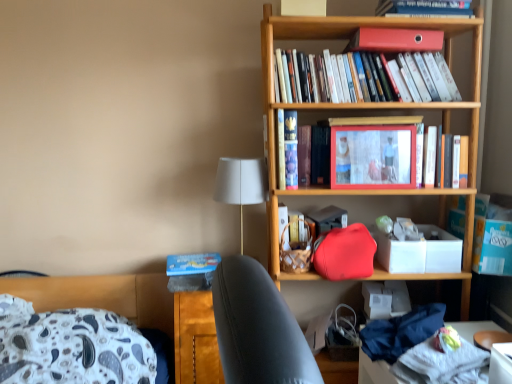
In order to face matte red book at upper center, which is the first paperback book in front-to-back order, should I rotate leftwards or rightwards?

To align with it, rotate right about 17.708°.

Where is `blue matte paperback book at lower left, which is the first paperback book in left-to-right order`? Image resolution: width=512 pixels, height=384 pixels. blue matte paperback book at lower left, which is the first paperback book in left-to-right order is located at coordinates (192, 263).

The height and width of the screenshot is (384, 512). What do you see at coordinates (241, 184) in the screenshot?
I see `white fabric lampshade at center` at bounding box center [241, 184].

Measure the distance between white fabric lampshade at center and camera.

white fabric lampshade at center and camera are 5.31 feet apart.

Describe the element at coordinates (420, 252) in the screenshot. I see `white matte box at center-right` at that location.

Find the location of a particular element. hardcover book at center, placed as the 3th book when sorted from top to bottom is located at coordinates (451, 160).

Where is `hardcover books at upper center, marked as the third book in a bottom-to-top arrangement`? The width and height of the screenshot is (512, 384). hardcover books at upper center, marked as the third book in a bottom-to-top arrangement is located at coordinates (362, 78).

Identify the location of matte red book at upper center, positioned as the first paperback book in right-to-left order. Image resolution: width=512 pixels, height=384 pixels. (395, 40).

From a real-world perspective, is blue matte paperback book at lower left, the first paperback book in the back-to-front sequence, below hardcover books at upper center, marked as the third book in a bottom-to-top arrangement?

Yes, from a real-world perspective, blue matte paperback book at lower left, the first paperback book in the back-to-front sequence, is beneath hardcover books at upper center, marked as the third book in a bottom-to-top arrangement.

Considering the positions of objects blue matte paperback book at lower left, the first paperback book from the bottom, and hardcover books at upper center, marked as the third book in a bottom-to-top arrangement, in the image provided, who is in front, blue matte paperback book at lower left, the first paperback book from the bottom, or hardcover books at upper center, marked as the third book in a bottom-to-top arrangement,?

hardcover books at upper center, marked as the third book in a bottom-to-top arrangement.

Looking at this image, is blue matte paperback book at lower left, which is the first paperback book in left-to-right order, directly adjacent to hardcover books at upper center, which is counted as the 1th book, starting from the top?

blue matte paperback book at lower left, which is the first paperback book in left-to-right order, and hardcover books at upper center, which is counted as the 1th book, starting from the top, are not in contact.

Considering the points (195, 269) and (436, 64), which point is in front, point (195, 269) or point (436, 64)?

Positioned in front is point (436, 64).

Relative to hardcover book at center, placed as the 3th book when sorted from top to bottom, is matte plastic picture frame at center in front or behind?

matte plastic picture frame at center is positioned closer to the viewer than hardcover book at center, placed as the 3th book when sorted from top to bottom.

From the image's perspective, between matte plastic picture frame at center and hardcover book at center, the first book in the bottom-to-top sequence, which one is located above?

From the image's view, matte plastic picture frame at center is above.

In terms of width, does matte plastic picture frame at center look wider or thinner when compared to hardcover book at center, the first book in the bottom-to-top sequence?

Clearly, matte plastic picture frame at center has less width compared to hardcover book at center, the first book in the bottom-to-top sequence.

Considering the relative positions of matte plastic picture frame at center and hardcover book at center, which is counted as the 2th book, starting from the bottom, in the image provided, is matte plastic picture frame at center behind hardcover book at center, which is counted as the 2th book, starting from the bottom,?

No, the depth of matte plastic picture frame at center is less than that of hardcover book at center, which is counted as the 2th book, starting from the bottom.

Consider the image. Is the surface of matte plastic picture frame at center in direct contact with hardcover book at center, which ranks as the second book in top-to-bottom order?

matte plastic picture frame at center and hardcover book at center, which ranks as the second book in top-to-bottom order, are clearly separated.

Who is bigger, matte plastic picture frame at center or hardcover book at center, which is counted as the 2th book, starting from the bottom?

hardcover book at center, which is counted as the 2th book, starting from the bottom, is bigger.

In terms of width, does matte plastic picture frame at center look wider or thinner when compared to hardcover book at center, which is counted as the 2th book, starting from the bottom?

Considering their sizes, matte plastic picture frame at center looks slimmer than hardcover book at center, which is counted as the 2th book, starting from the bottom.

Can you confirm if hardcover book at center, which ranks as the second book in top-to-bottom order, is taller than blue matte paperback book at lower left, the first paperback book in the back-to-front sequence?

Yes, hardcover book at center, which ranks as the second book in top-to-bottom order, is taller than blue matte paperback book at lower left, the first paperback book in the back-to-front sequence.

In the scene shown: Can you tell me how much hardcover book at center, which is counted as the 2th book, starting from the bottom, and blue matte paperback book at lower left, the 2th paperback book positioned from the top, differ in facing direction?

The facing directions of hardcover book at center, which is counted as the 2th book, starting from the bottom, and blue matte paperback book at lower left, the 2th paperback book positioned from the top, are 5.22 degrees apart.

Looking at this image, which object is thinner, hardcover book at center, which is counted as the 2th book, starting from the bottom, or blue matte paperback book at lower left, which ranks as the 2th paperback book in front-to-back order?

hardcover book at center, which is counted as the 2th book, starting from the bottom.

From a real-world perspective, which is physically below, hardcover book at center, which is counted as the 2th book, starting from the bottom, or blue matte paperback book at lower left, the 2th paperback book positioned from the top?

From a 3D spatial view, blue matte paperback book at lower left, the 2th paperback book positioned from the top, is below.

Is hardcover book at center, placed as the 3th book when sorted from top to bottom, inside matte red book at upper center, acting as the second paperback book starting from the left?

No, hardcover book at center, placed as the 3th book when sorted from top to bottom, is not surrounded by matte red book at upper center, acting as the second paperback book starting from the left.

From the image's perspective, which is above, matte red book at upper center, positioned as the first paperback book in right-to-left order, or hardcover book at center, the first book in the bottom-to-top sequence?

From the image's view, matte red book at upper center, positioned as the first paperback book in right-to-left order, is above.

Who is shorter, matte red book at upper center, positioned as the first paperback book in right-to-left order, or hardcover book at center, placed as the 3th book when sorted from top to bottom?

matte red book at upper center, positioned as the first paperback book in right-to-left order, is shorter.

Does matte red book at upper center, which is the first paperback book in front-to-back order, have a lesser width compared to hardcover book at center, placed as the 3th book when sorted from top to bottom?

In fact, matte red book at upper center, which is the first paperback book in front-to-back order, might be wider than hardcover book at center, placed as the 3th book when sorted from top to bottom.

Is blue matte paperback book at lower left, acting as the second paperback book starting from the right, not close to white matte box at center-right?

blue matte paperback book at lower left, acting as the second paperback book starting from the right, is actually quite close to white matte box at center-right.

In terms of height, does blue matte paperback book at lower left, the 2th paperback book positioned from the top, look taller or shorter compared to white matte box at center-right?

→ Considering their sizes, blue matte paperback book at lower left, the 2th paperback book positioned from the top, has less height than white matte box at center-right.

Is blue matte paperback book at lower left, which is the first paperback book in left-to-right order, oriented towards white matte box at center-right?

No, blue matte paperback book at lower left, which is the first paperback book in left-to-right order, is not facing towards white matte box at center-right.

From the image's perspective, would you say matte red book at upper center, the 2th paperback book when ordered from back to front, is positioned over hardcover book at center, which ranks as the second book in top-to-bottom order?

Yes, from the image's perspective, matte red book at upper center, the 2th paperback book when ordered from back to front, is on top of hardcover book at center, which ranks as the second book in top-to-bottom order.

Is matte red book at upper center, which ranks as the first paperback book in top-to-bottom order, oriented towards hardcover book at center, which is counted as the 2th book, starting from the bottom?

No, matte red book at upper center, which ranks as the first paperback book in top-to-bottom order, is not turned towards hardcover book at center, which is counted as the 2th book, starting from the bottom.

Considering their positions, is matte red book at upper center, positioned as the first paperback book in right-to-left order, located in front of or behind hardcover book at center, which ranks as the second book in top-to-bottom order?

Clearly, matte red book at upper center, positioned as the first paperback book in right-to-left order, is in front of hardcover book at center, which ranks as the second book in top-to-bottom order.

I want to click on book that is the 2nd one below the matte red book at upper center, the 2th paperback book ordered from the bottom (from a real-world perspective), so click(x=300, y=152).

This screenshot has width=512, height=384. Identify the location of the 3rd book positioned above the blue matte paperback book at lower left, acting as the second paperback book starting from the right (from a real-world perspective). (362, 78).

Locate an element on the screen. The width and height of the screenshot is (512, 384). book that appears on the right of matte plastic picture frame at center is located at coordinates (451, 160).

Considering their positions, is hardcover book at center, the first book in the bottom-to-top sequence, positioned closer to white fabric lampshade at center than matte plastic picture frame at center?

Among the two, matte plastic picture frame at center is located nearer to white fabric lampshade at center.

Estimate the real-world distances between objects in this image. Which object is closer to hardcover book at center, which is counted as the 2th book, starting from the bottom, matte plastic picture frame at center or hardcover books at upper center, marked as the third book in a bottom-to-top arrangement?

matte plastic picture frame at center is closer to hardcover book at center, which is counted as the 2th book, starting from the bottom.

Considering their positions, is matte red book at upper center, acting as the second paperback book starting from the left, positioned closer to blue matte paperback book at lower left, the first paperback book from the bottom, than white fabric lampshade at center?

Based on the image, white fabric lampshade at center appears to be nearer to blue matte paperback book at lower left, the first paperback book from the bottom.

Considering their positions, is white fabric lampshade at center positioned closer to matte plastic picture frame at center than white fabric at lower right?

white fabric lampshade at center is positioned closer to the anchor matte plastic picture frame at center.

Based on their spatial positions, is blue matte paperback book at lower left, the 2th paperback book positioned from the top, or matte red book at upper center, acting as the second paperback book starting from the left, closer to white matte box at center-right?

matte red book at upper center, acting as the second paperback book starting from the left, is closer to white matte box at center-right.

Estimate the real-world distances between objects in this image. Which object is closer to hardcover books at upper center, marked as the third book in a bottom-to-top arrangement, white fabric lampshade at center or hardcover book at center, which ranks as the second book in top-to-bottom order?

The object closer to hardcover books at upper center, marked as the third book in a bottom-to-top arrangement, is hardcover book at center, which ranks as the second book in top-to-bottom order.

When comparing their distances from white matte box at center-right, does matte red book at upper center, acting as the second paperback book starting from the left, or blue matte paperback book at lower left, the first paperback book from the bottom, seem further?

blue matte paperback book at lower left, the first paperback book from the bottom, is further to white matte box at center-right.

Based on their spatial positions, is hardcover books at upper center, which is counted as the 1th book, starting from the top, or matte plastic picture frame at center closer to hardcover book at center, placed as the 3th book when sorted from top to bottom?

matte plastic picture frame at center is positioned closer to the anchor hardcover book at center, placed as the 3th book when sorted from top to bottom.

Locate an element on the screen. This screenshot has height=384, width=512. picture frame between matte red book at upper center, which ranks as the first paperback book in top-to-bottom order, and white fabric at lower right vertically is located at coordinates (373, 157).

In order to click on book between hardcover book at center, which is counted as the 2th book, starting from the bottom, and white fabric at lower right vertically in this screenshot , I will do `click(451, 160)`.

Where is `book between hardcover books at upper center, marked as the third book in a bottom-to-top arrangement, and matte plastic picture frame at center vertically`? This screenshot has width=512, height=384. book between hardcover books at upper center, marked as the third book in a bottom-to-top arrangement, and matte plastic picture frame at center vertically is located at coordinates (300, 152).

Identify the location of table between blue matte paperback book at lower left, which ranks as the 2th paperback book in front-to-back order, and white matte box at center-right from left to right. (374, 372).